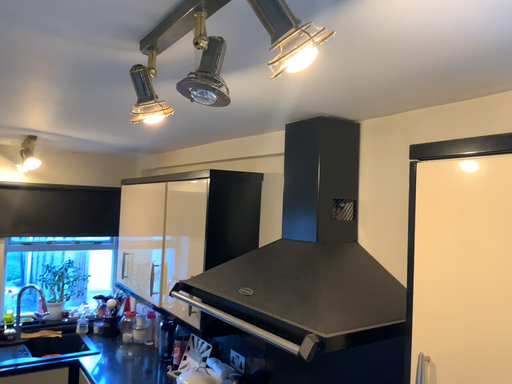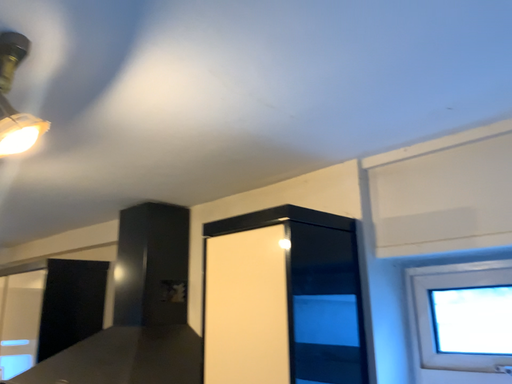
Question: How did the camera likely rotate when shooting the video?

Choices:
 (A) rotated right
 (B) rotated left

Answer: (A)